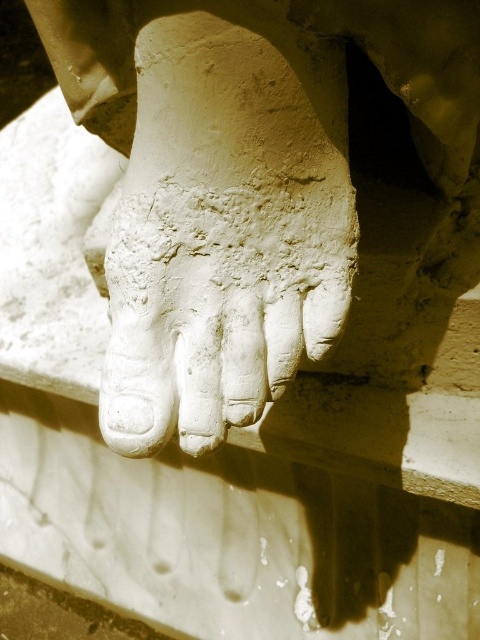
Question: Does white stone foot at center appear on the right side of white stone hand at center?

Choices:
 (A) yes
 (B) no

Answer: (A)

Question: Which point appears closest to the camera in this image?

Choices:
 (A) (288, 4)
 (B) (196, 225)

Answer: (A)

Question: Is white stone foot at center thinner than white stone hand at center?

Choices:
 (A) no
 (B) yes

Answer: (A)

Question: Which point is farther to the camera?

Choices:
 (A) white stone hand at center
 (B) white stone foot at center

Answer: (A)

Question: Is white stone foot at center above white stone hand at center?

Choices:
 (A) no
 (B) yes

Answer: (B)